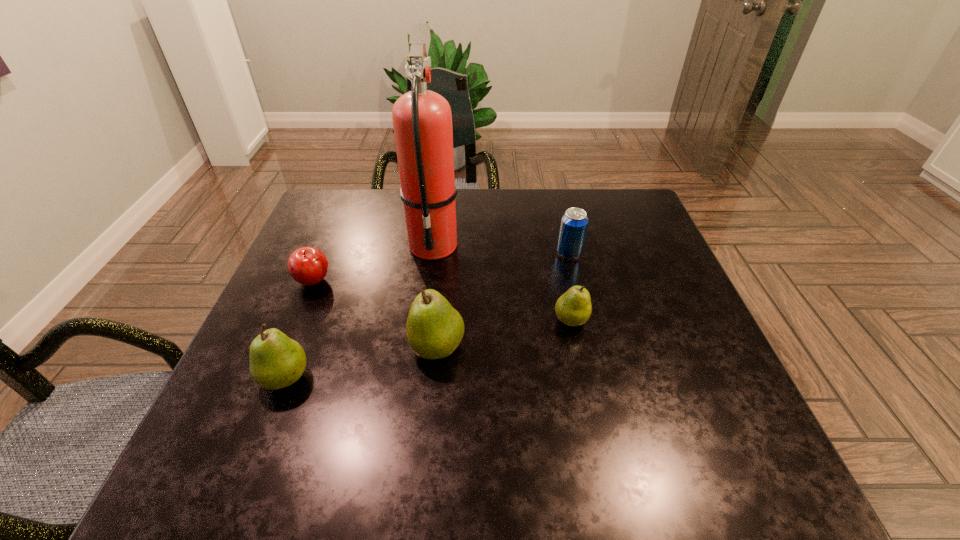
Identify the location of empty location between the cherry and the leftmost pear. (300, 329).

Image resolution: width=960 pixels, height=540 pixels. What are the coordinates of `object identified as the fourth closest to the second tallest pear` in the screenshot? It's located at (573, 308).

Identify which object is the fourth closest to the leftmost pear. Please provide its 2D coordinates. Your answer should be formatted as a tuple, i.e. [(x, y)], where the tuple contains the x and y coordinates of a point satisfying the conditions above.

[(573, 308)]

Identify which pear is the closest to the fire extinguisher. Please provide its 2D coordinates. Your answer should be formatted as a tuple, i.e. [(x, y)], where the tuple contains the x and y coordinates of a point satisfying the conditions above.

[(434, 329)]

Identify which pear is the second nearest to the cherry. Please provide its 2D coordinates. Your answer should be formatted as a tuple, i.e. [(x, y)], where the tuple contains the x and y coordinates of a point satisfying the conditions above.

[(434, 329)]

Find the location of a particular element. The width and height of the screenshot is (960, 540). vacant area in the image that satisfies the following two spatial constraints: 1. on the back side of the leftmost pear; 2. on the left side of the rightmost pear is located at coordinates (308, 320).

Locate an element on the screen. vacant region that satisfies the following two spatial constraints: 1. on the hose direction of the beer can; 2. on the left side of the tallest object is located at coordinates (432, 253).

The height and width of the screenshot is (540, 960). I want to click on vacant region that satisfies the following two spatial constraints: 1. on the front side of the cherry; 2. on the left side of the tallest pear, so click(x=286, y=347).

Identify the location of blank space that satisfies the following two spatial constraints: 1. on the back side of the shortest pear; 2. on the right side of the beer can. (557, 253).

I want to click on free location that satisfies the following two spatial constraints: 1. on the hose direction of the tallest object; 2. on the right side of the beer can, so click(x=432, y=253).